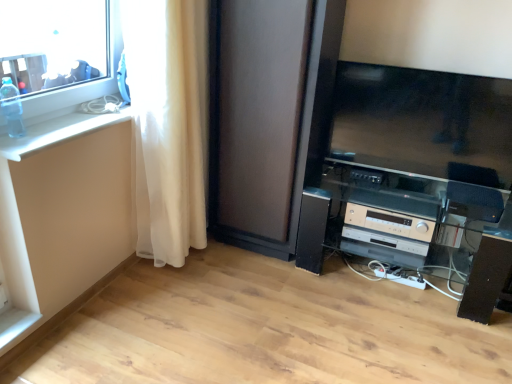
At what (x,y) coordinates should I click in order to perform the action: click on free spot in front of white sheer curtain at left. Please return your answer as a coordinate pair (x, y). The image size is (512, 384). Looking at the image, I should click on (172, 301).